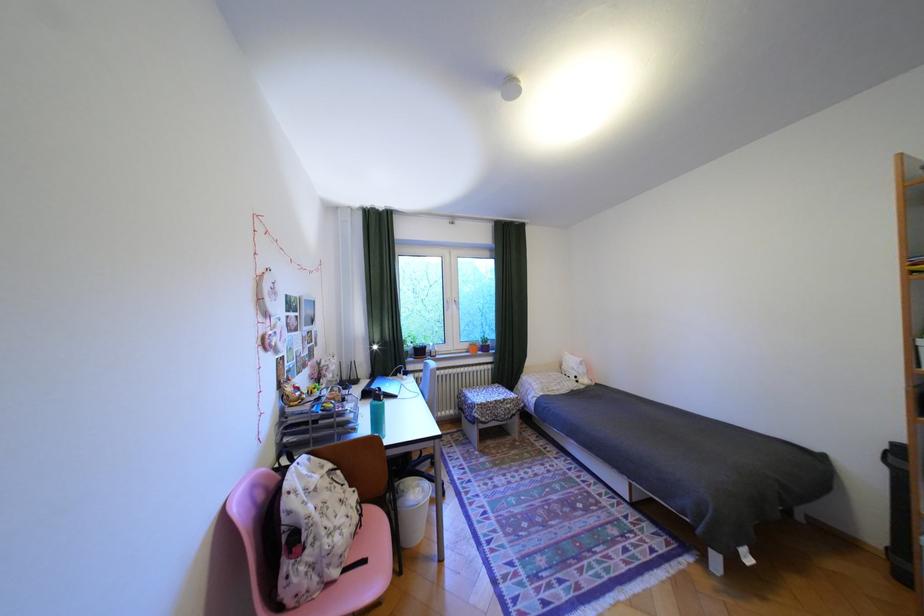
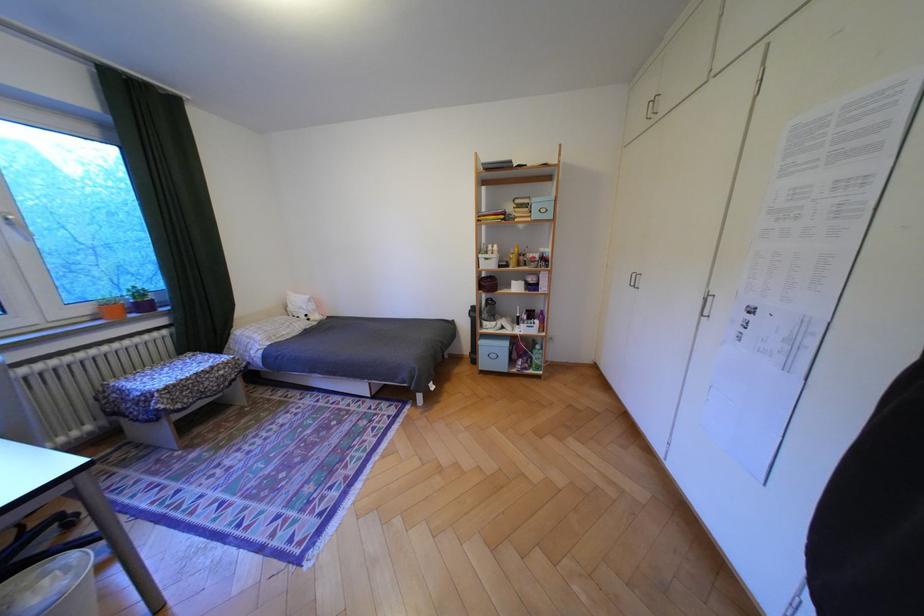
Locate, in the second image, the point that corresponds to pixel 496 349 in the first image.

(155, 307)